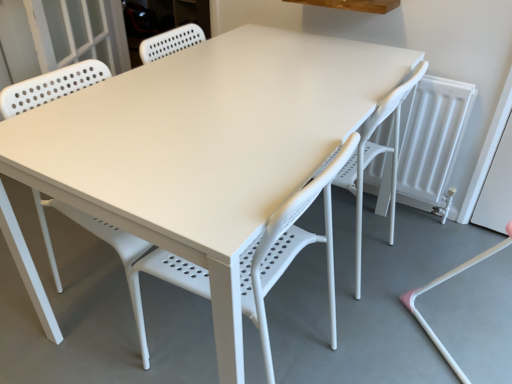
Identify the location of vacant space underneath white plastic chair at center (from a real-world perspective). (269, 344).